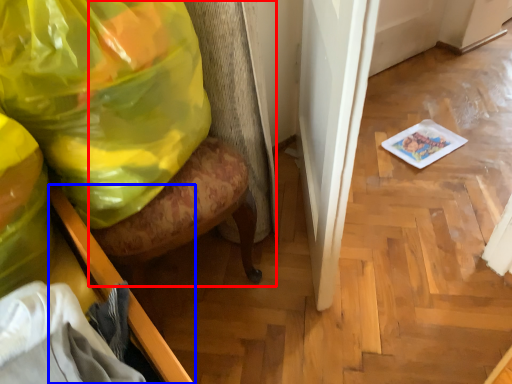
Question: Which object appears farthest to the camera in this image, swivel chair (highlighted by a red box) or furniture (highlighted by a blue box)?

Choices:
 (A) swivel chair
 (B) furniture

Answer: (A)